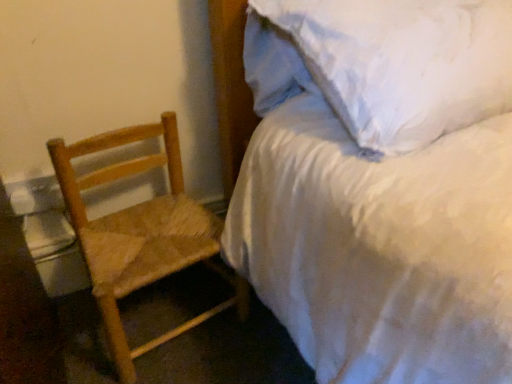
What do you see at coordinates (140, 233) in the screenshot?
I see `natural wood woven chair at left` at bounding box center [140, 233].

Where is `natural wood woven chair at left`? This screenshot has width=512, height=384. natural wood woven chair at left is located at coordinates (140, 233).

The image size is (512, 384). Describe the element at coordinates (381, 186) in the screenshot. I see `white satin bed at upper right` at that location.

Where is `white satin bed at upper right`? white satin bed at upper right is located at coordinates (381, 186).

I want to click on natural wood woven chair at left, so click(140, 233).

In the image, is white satin bed at upper right on the left side or the right side of natural wood woven chair at left?

In the image, white satin bed at upper right appears on the right side of natural wood woven chair at left.

Based on the photo, does white satin bed at upper right come behind natural wood woven chair at left?

No, white satin bed at upper right is closer to the camera.

Does point (291, 221) appear closer or farther from the camera than point (212, 230)?

Clearly, point (291, 221) is closer to the camera than point (212, 230).

In the scene shown: From the image's perspective, which one is positioned lower, white satin bed at upper right or natural wood woven chair at left?

From the image's view, natural wood woven chair at left is below.

From a real-world perspective, is white satin bed at upper right physically located above or below natural wood woven chair at left?

white satin bed at upper right is above natural wood woven chair at left.

Looking at their sizes, would you say white satin bed at upper right is wider or thinner than natural wood woven chair at left?

In the image, white satin bed at upper right appears to be wider than natural wood woven chair at left.

Which of these two, white satin bed at upper right or natural wood woven chair at left, stands shorter?

natural wood woven chair at left.

Is white satin bed at upper right smaller than natural wood woven chair at left?

No, white satin bed at upper right is not smaller than natural wood woven chair at left.

Can natural wood woven chair at left be found inside white satin bed at upper right?

Actually, natural wood woven chair at left is outside white satin bed at upper right.

Is white satin bed at upper right in contact with natural wood woven chair at left?

→ They are not placed beside each other.

Could you tell me if white satin bed at upper right is turned towards natural wood woven chair at left?

No.

From the picture: How many degrees apart are the facing directions of white satin bed at upper right and natural wood woven chair at left?

1.1 degrees.

How much distance is there between white satin bed at upper right and natural wood woven chair at left?

white satin bed at upper right and natural wood woven chair at left are 12.41 inches apart from each other.

This screenshot has width=512, height=384. What are the coordinates of `chair on the left of white satin bed at upper right` in the screenshot? It's located at (140, 233).

Considering the relative positions of natural wood woven chair at left and white satin bed at upper right in the image provided, is natural wood woven chair at left to the left of white satin bed at upper right from the viewer's perspective?

Correct, you'll find natural wood woven chair at left to the left of white satin bed at upper right.

Considering the positions of objects natural wood woven chair at left and white satin bed at upper right in the image provided, who is in front, natural wood woven chair at left or white satin bed at upper right?

Positioned in front is white satin bed at upper right.

Is point (74, 145) behind point (480, 196)?

Yes.

From the image's perspective, which is above, natural wood woven chair at left or white satin bed at upper right?

white satin bed at upper right appears higher in the image.

From a real-world perspective, is natural wood woven chair at left positioned under white satin bed at upper right based on gravity?

Correct, in the physical world, natural wood woven chair at left is lower than white satin bed at upper right.

Considering the sizes of objects natural wood woven chair at left and white satin bed at upper right in the image provided, who is wider, natural wood woven chair at left or white satin bed at upper right?

white satin bed at upper right is wider.

Is natural wood woven chair at left taller than white satin bed at upper right?

In fact, natural wood woven chair at left may be shorter than white satin bed at upper right.

In the scene shown: Can you confirm if natural wood woven chair at left is smaller than white satin bed at upper right?

Yes, natural wood woven chair at left is smaller than white satin bed at upper right.

Would you say natural wood woven chair at left is outside white satin bed at upper right?

Yes, natural wood woven chair at left is outside of white satin bed at upper right.

Is natural wood woven chair at left beside white satin bed at upper right?

natural wood woven chair at left and white satin bed at upper right are clearly separated.

Could you tell me if natural wood woven chair at left is facing white satin bed at upper right?

No, natural wood woven chair at left is not oriented towards white satin bed at upper right.

In the image, there is a white satin bed at upper right. Where is `chair below it (from a real-world perspective)`? chair below it (from a real-world perspective) is located at coordinates (140, 233).

The height and width of the screenshot is (384, 512). Identify the location of bed above the natural wood woven chair at left (from the image's perspective). (381, 186).

I want to click on chair on the left of white satin bed at upper right, so click(x=140, y=233).